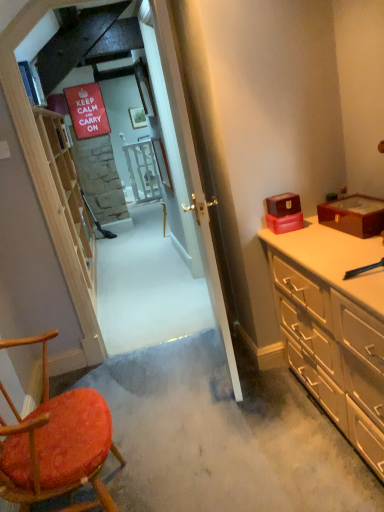
Question: From a real-world perspective, is light wood shelf at left located higher than matte red box at right, the 1th box when ordered from left to right?

Choices:
 (A) no
 (B) yes

Answer: (B)

Question: Considering the relative sizes of light wood shelf at left and matte red box at right, the 1th box when ordered from left to right, in the image provided, is light wood shelf at left shorter than matte red box at right, the 1th box when ordered from left to right,?

Choices:
 (A) yes
 (B) no

Answer: (B)

Question: Would you say light wood shelf at left is outside matte red box at right, the second box in the right-to-left sequence?

Choices:
 (A) yes
 (B) no

Answer: (A)

Question: From the image's perspective, is light wood shelf at left beneath matte red box at right, the second box in the right-to-left sequence?

Choices:
 (A) no
 (B) yes

Answer: (A)

Question: Are light wood shelf at left and matte red box at right, the second box in the right-to-left sequence, making contact?

Choices:
 (A) yes
 (B) no

Answer: (B)

Question: In the image, is beige wood dresser at right on the left side or the right side of light wood shelf at left?

Choices:
 (A) left
 (B) right

Answer: (B)

Question: Considering the positions of point (374, 423) and point (41, 109), is point (374, 423) closer or farther from the camera than point (41, 109)?

Choices:
 (A) farther
 (B) closer

Answer: (B)

Question: Looking at their shapes, would you say beige wood dresser at right is wider or thinner than light wood shelf at left?

Choices:
 (A) wide
 (B) thin

Answer: (A)

Question: Is beige wood dresser at right taller or shorter than light wood shelf at left?

Choices:
 (A) tall
 (B) short

Answer: (B)

Question: Which is correct: shiny burgundy box at right, which appears as the second box when viewed from the left, is inside light wood shelf at left, or outside of it?

Choices:
 (A) outside
 (B) inside

Answer: (A)

Question: Considering the relative positions of shiny burgundy box at right, acting as the 1th box starting from the right, and light wood shelf at left in the image provided, is shiny burgundy box at right, acting as the 1th box starting from the right, to the left or to the right of light wood shelf at left?

Choices:
 (A) left
 (B) right

Answer: (B)

Question: From a real-world perspective, is shiny burgundy box at right, which appears as the second box when viewed from the left, physically located above or below light wood shelf at left?

Choices:
 (A) above
 (B) below

Answer: (B)

Question: Considering the positions of shiny burgundy box at right, which appears as the second box when viewed from the left, and light wood shelf at left in the image, is shiny burgundy box at right, which appears as the second box when viewed from the left, taller or shorter than light wood shelf at left?

Choices:
 (A) short
 (B) tall

Answer: (A)

Question: From the image's perspective, is light wood shelf at left located above or below beige wood dresser at right?

Choices:
 (A) above
 (B) below

Answer: (A)

Question: Is point (76, 242) positioned closer to the camera than point (352, 289)?

Choices:
 (A) closer
 (B) farther

Answer: (B)